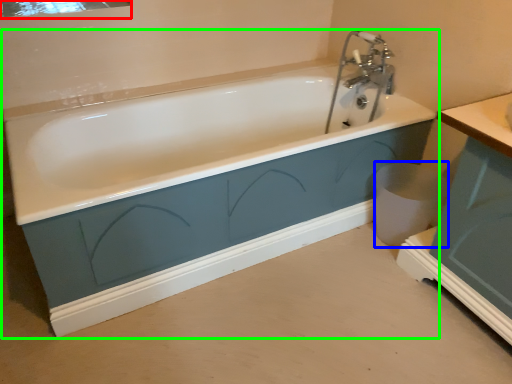
Question: Estimate the real-world distances between objects in this image. Which object is farther from mirror (highlighted by a red box), toilet bowl (highlighted by a blue box) or bathtub (highlighted by a green box)?

Choices:
 (A) toilet bowl
 (B) bathtub

Answer: (A)